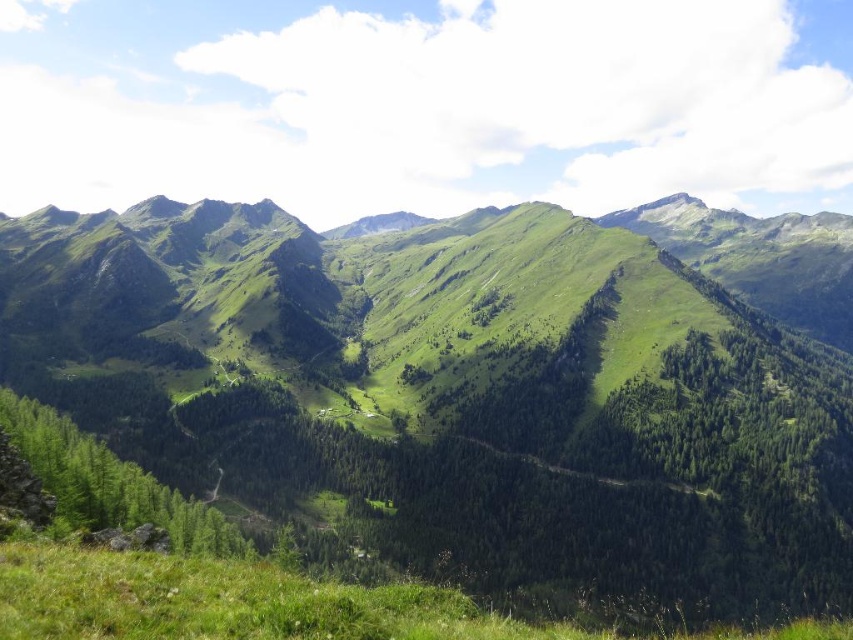
Which is below, green grassy mountain at center or green grassy at lower center?

Positioned lower is green grassy at lower center.

Who is shorter, green grassy mountain at center or green grassy at lower center?

Standing shorter between the two is green grassy at lower center.

Which is behind, point (482, 456) or point (274, 636)?

The point (482, 456) is behind.

Where is `green grassy mountain at center`? green grassy mountain at center is located at coordinates (473, 381).